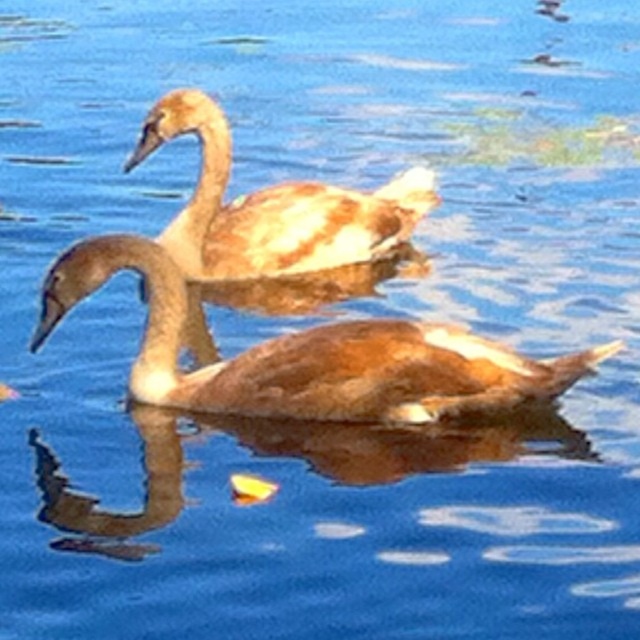
Which of these two, brown matte swan at center or brown feathered swan at upper center, stands taller?

brown feathered swan at upper center is taller.

Can you confirm if brown matte swan at center is positioned to the right of brown feathered swan at upper center?

Yes, brown matte swan at center is to the right of brown feathered swan at upper center.

What do you see at coordinates (308, 355) in the screenshot? I see `brown matte swan at center` at bounding box center [308, 355].

Locate an element on the screen. Image resolution: width=640 pixels, height=640 pixels. brown matte swan at center is located at coordinates (308, 355).